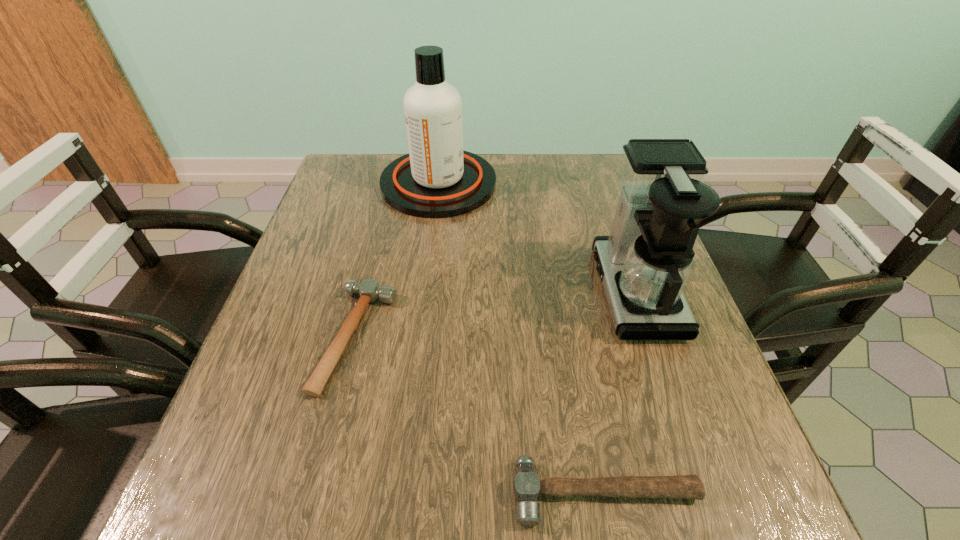
At what (x,y) coordinates should I click in order to perform the action: click on vacant region at the near edge. Please return your answer as a coordinate pair (x, y). This screenshot has width=960, height=540. Looking at the image, I should click on (589, 507).

At what (x,y) coordinates should I click in order to perform the action: click on free location at the left edge of the desktop. Please return your answer as a coordinate pair (x, y). The width and height of the screenshot is (960, 540). Looking at the image, I should click on (283, 397).

The width and height of the screenshot is (960, 540). In the image, there is a desktop. In order to click on free space at the right edge in this screenshot , I will do `click(636, 381)`.

Where is `free spot at the far left corner of the desktop`? free spot at the far left corner of the desktop is located at coordinates (342, 186).

Locate an element on the screen. Image resolution: width=960 pixels, height=540 pixels. free region at the near left corner of the desktop is located at coordinates (282, 476).

This screenshot has height=540, width=960. I want to click on free spot at the near right corner of the desktop, so click(669, 512).

This screenshot has width=960, height=540. What are the coordinates of `vacant space in between the nearest object and the coffee maker` in the screenshot? It's located at (620, 392).

At what (x,y) coordinates should I click in order to perform the action: click on free space between the tallest object and the right hammer. Please return your answer as a coordinate pair (x, y). The image size is (960, 540). Looking at the image, I should click on (522, 338).

This screenshot has width=960, height=540. What are the coordinates of `empty location between the farther hammer and the second tallest object` in the screenshot? It's located at (496, 315).

I want to click on free spot between the coffee maker and the farther hammer, so click(x=496, y=315).